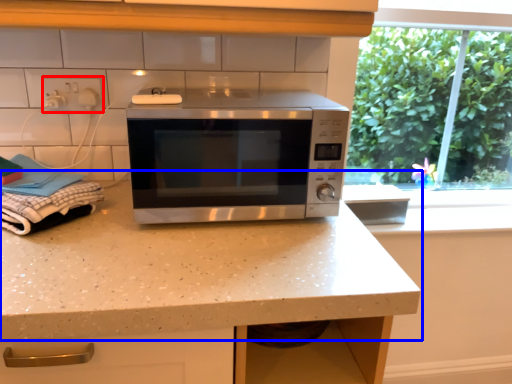
Question: Which object appears closest to the camera in this image, electric outlet (highlighted by a red box) or countertop (highlighted by a blue box)?

Choices:
 (A) electric outlet
 (B) countertop

Answer: (B)